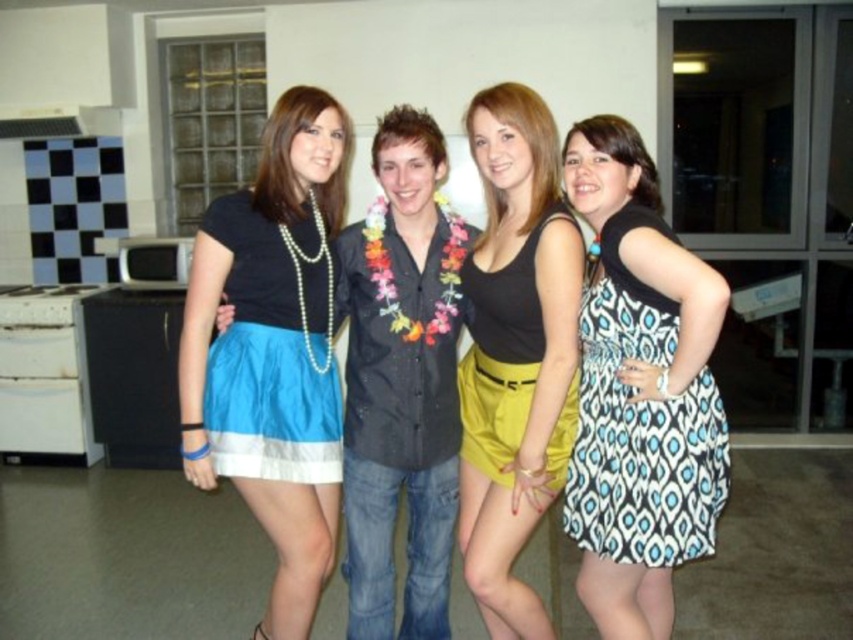
Does point (334, 273) lie in front of point (599, 497)?

No.

Does shiny blue skirt at center appear under black and white patterned dress at right?

Incorrect, shiny blue skirt at center is not positioned below black and white patterned dress at right.

What do you see at coordinates (273, 349) in the screenshot? This screenshot has width=853, height=640. I see `shiny blue skirt at center` at bounding box center [273, 349].

Image resolution: width=853 pixels, height=640 pixels. I want to click on shiny blue skirt at center, so click(273, 349).

Does black and white patterned dress at right have a greater height compared to blue satin skirt at center?

Yes.

Which is more to the right, black and white patterned dress at right or blue satin skirt at center?

Positioned to the right is black and white patterned dress at right.

At what (x,y) coordinates should I click in order to perform the action: click on black and white patterned dress at right. Please return your answer as a coordinate pair (x, y). This screenshot has width=853, height=640. Looking at the image, I should click on (640, 422).

Does matte black tank top at center appear over blue satin skirt at center?

No.

Which is more to the left, matte black tank top at center or blue satin skirt at center?

blue satin skirt at center is more to the left.

The image size is (853, 640). I want to click on matte black tank top at center, so coord(515,353).